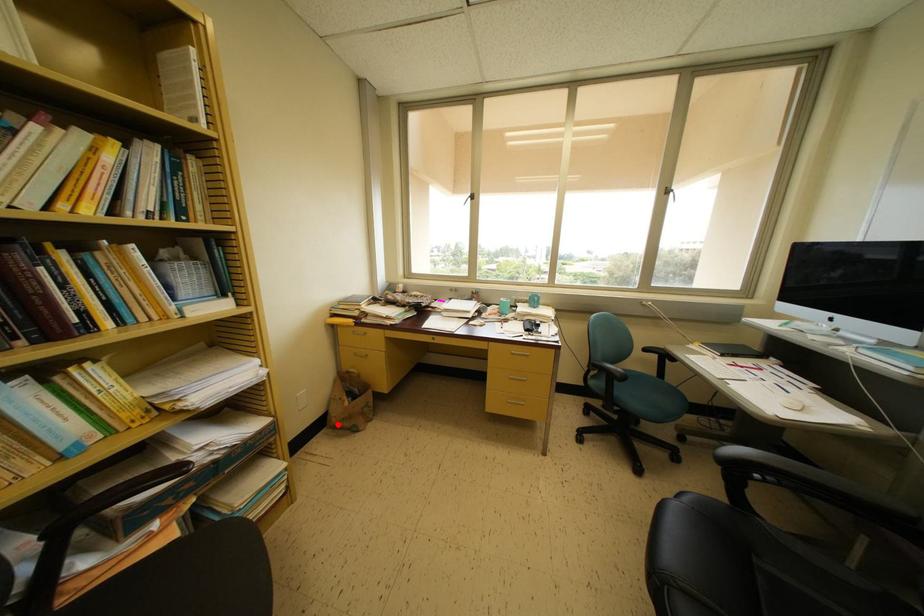
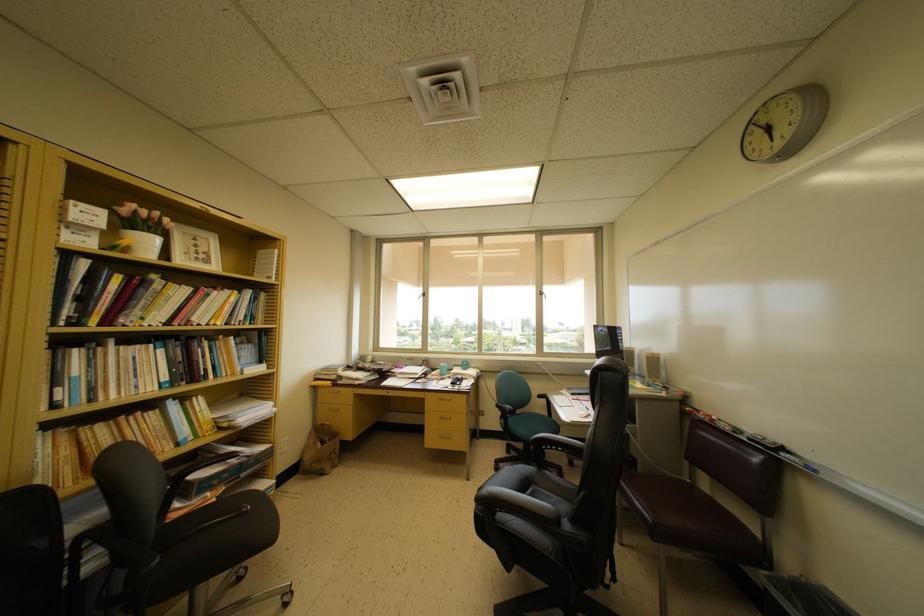
Question: I am providing you with two images of the same scene from different viewpoints. In image1, a red point is highlighted. Considering the same 3D point in image2, which of the following is correct?

Choices:
 (A) It is closer
 (B) It is farther

Answer: (B)